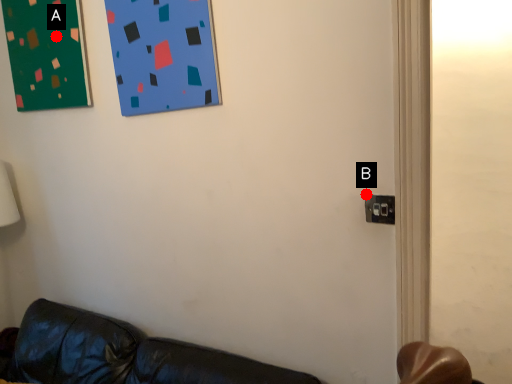
Question: Two points are circled on the image, labeled by A and B beside each circle. Among these points, which one is nearest to the camera?

Choices:
 (A) A is closer
 (B) B is closer

Answer: (B)